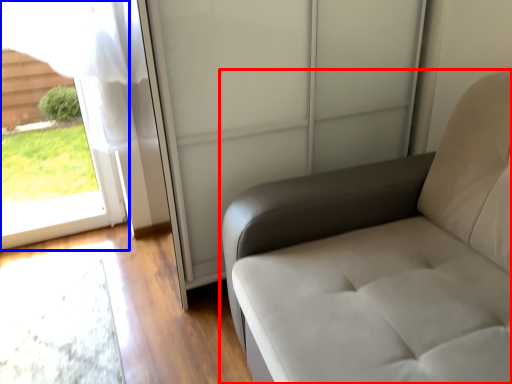
Question: Which object appears closest to the camera in this image, furniture (highlighted by a red box) or window (highlighted by a blue box)?

Choices:
 (A) furniture
 (B) window

Answer: (A)